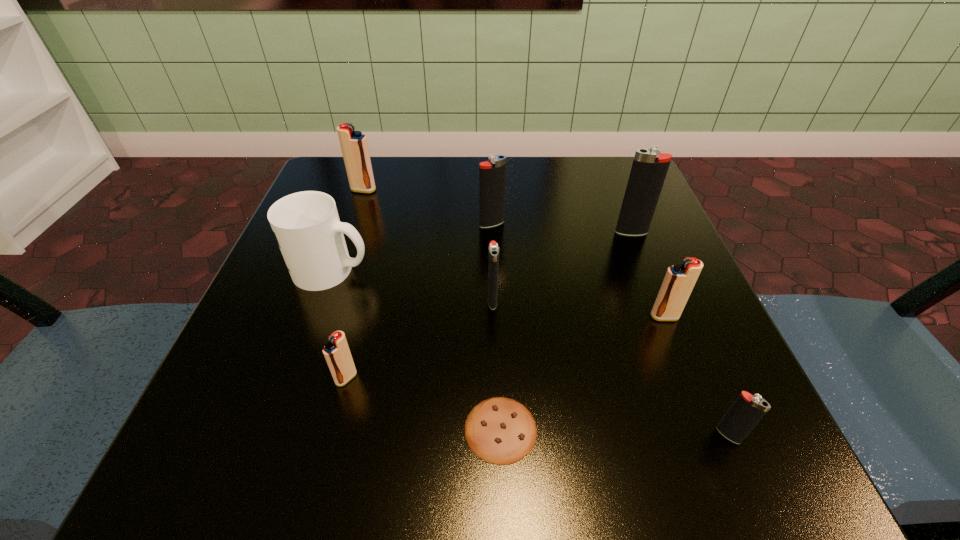
Find the location of a particular element. the second farthest black igniter is located at coordinates (649, 169).

The width and height of the screenshot is (960, 540). I want to click on the tallest igniter, so click(649, 169).

Find the location of a particular element. The width and height of the screenshot is (960, 540). the farthest igniter is located at coordinates (354, 146).

Identify the location of the farthest object. The image size is (960, 540). (354, 146).

The width and height of the screenshot is (960, 540). I want to click on the farthest black igniter, so click(492, 176).

Locate an element on the screen. the second farthest igniter is located at coordinates (492, 176).

Image resolution: width=960 pixels, height=540 pixels. I want to click on mug, so click(x=306, y=225).

Where is `the sixth nearest object`? the sixth nearest object is located at coordinates (306, 225).

Where is `the fifth nearest object`? The height and width of the screenshot is (540, 960). the fifth nearest object is located at coordinates (493, 254).

You are a GUI agent. You are given a task and a screenshot of the screen. Output one action in this format:
    pyautogui.click(x=<x>, y=<y>)
    Task: Click on the third biggest black igniter
    Image resolution: width=960 pixels, height=540 pixels.
    Given the screenshot: What is the action you would take?
    pyautogui.click(x=493, y=254)